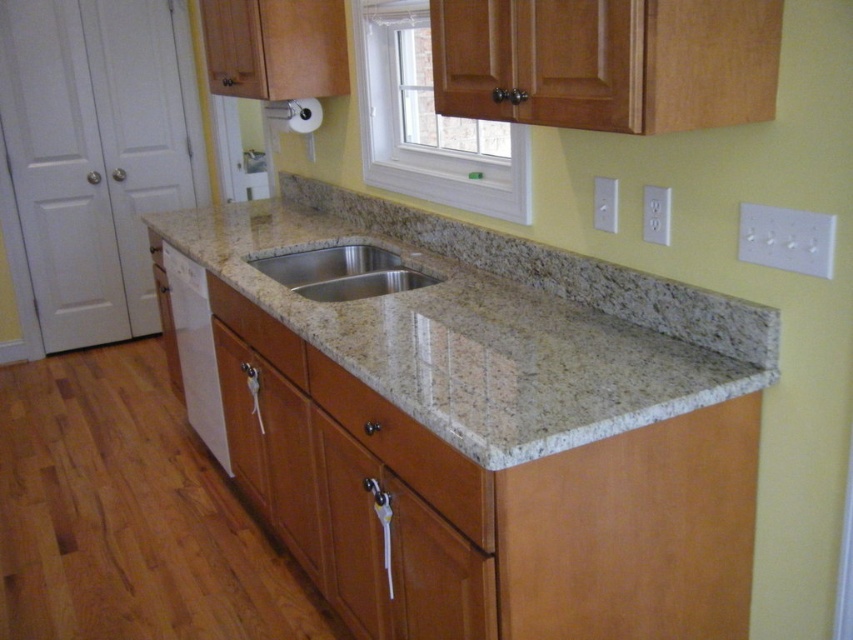
Question: Can you confirm if white plastic window at upper center is wider than white glossy dishwasher at lower left?

Choices:
 (A) yes
 (B) no

Answer: (A)

Question: Which of the following is the farthest from the observer?

Choices:
 (A) granite countertop at center
 (B) stainless steel sink at center

Answer: (B)

Question: Can you confirm if stainless steel sink at center is smaller than matte wood drawer at center?

Choices:
 (A) no
 (B) yes

Answer: (B)

Question: Which of the following is the farthest from the observer?

Choices:
 (A) matte wood drawer at center
 (B) white glossy dishwasher at lower left
 (C) stainless steel sink at center

Answer: (B)

Question: Which of these objects is positioned closest to the matte wood drawer at center?

Choices:
 (A) white glossy dishwasher at lower left
 (B) stainless steel sink at center
 (C) granite countertop at center
 (D) white plastic window at upper center

Answer: (B)

Question: Can you confirm if white plastic window at upper center is positioned to the right of stainless steel sink at center?

Choices:
 (A) yes
 (B) no

Answer: (A)